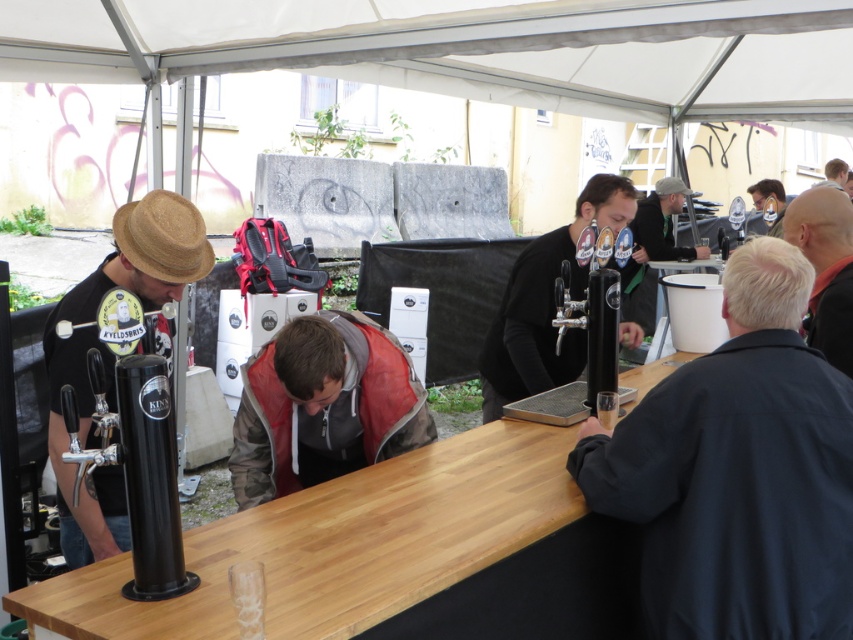
Question: Is white fabric canopy at upper center wider than dark blue jacket at right?

Choices:
 (A) no
 (B) yes

Answer: (B)

Question: Which point is farther to the camera?

Choices:
 (A) (616, 180)
 (B) (239, 54)
 (C) (831, 218)

Answer: (B)

Question: Which point is closer to the camera?

Choices:
 (A) matte black jacket at center
 (B) white fabric canopy at upper center

Answer: (B)

Question: Is the position of matte black beer tap at center more distant than that of matte black glasses at upper right?

Choices:
 (A) yes
 (B) no

Answer: (B)

Question: Is matte black hat at left bigger than matte black glasses at upper right?

Choices:
 (A) yes
 (B) no

Answer: (B)

Question: Which of the following is the farthest from the observer?

Choices:
 (A) (631, 308)
 (B) (845, 632)
 (C) (392, 365)
 (D) (206, 260)

Answer: (A)